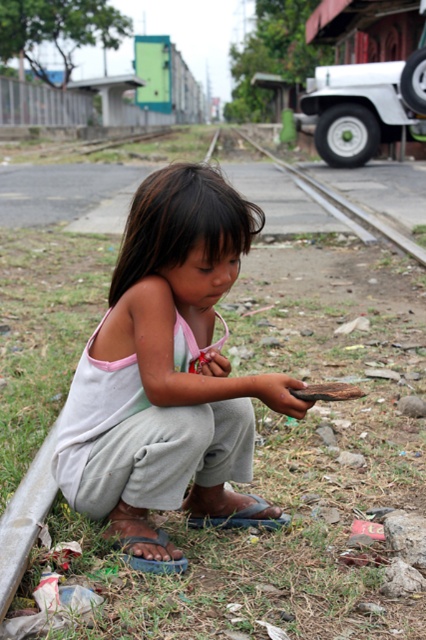
Question: Is light gray cotton pants at center bigger than metal train track at center?

Choices:
 (A) no
 (B) yes

Answer: (A)

Question: Is light gray cotton pants at center above metal train track at center?

Choices:
 (A) no
 (B) yes

Answer: (A)

Question: Which point appears closest to the camera in this image?

Choices:
 (A) tap(267, 154)
 (B) tap(253, 221)

Answer: (B)

Question: Does light gray cotton pants at center appear on the left side of metal train track at center?

Choices:
 (A) no
 (B) yes

Answer: (B)

Question: Among these objects, which one is farthest from the camera?

Choices:
 (A) metal train track at center
 (B) light gray cotton pants at center

Answer: (A)